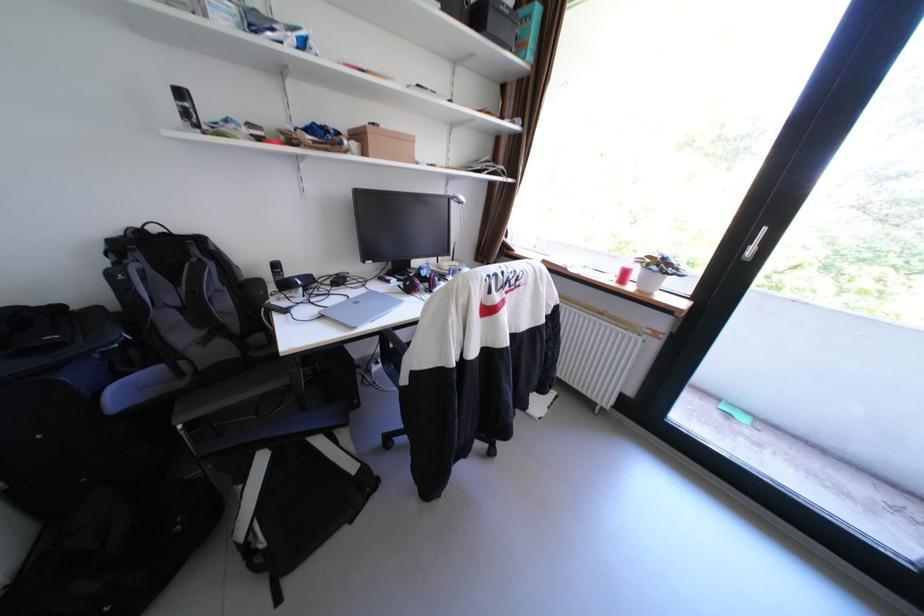
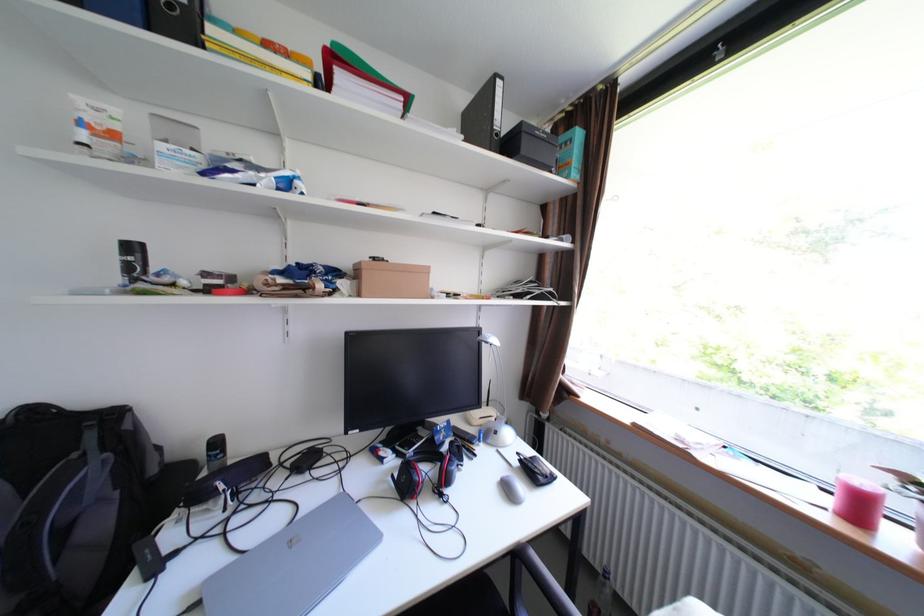
Question: I am providing you with two images of the same scene from different viewpoints. Which of the following objects are not visible in image2?

Choices:
 (A) black window handle
 (B) black spray can
 (C) pink cylindrical candle
 (D) none of these

Answer: (D)